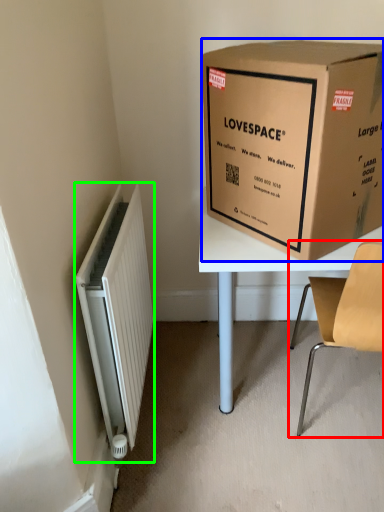
Question: Estimate the real-world distances between objects in this image. Which object is closer to chair (highlighted by a red box), box (highlighted by a blue box) or radiator (highlighted by a green box)?

Choices:
 (A) box
 (B) radiator

Answer: (A)